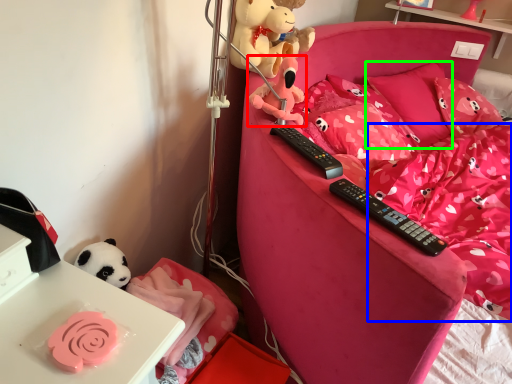
Question: Which is nearer to the toy (highlighted by a red box)? bedding (highlighted by a blue box) or pillow (highlighted by a green box).

Choices:
 (A) bedding
 (B) pillow

Answer: (A)